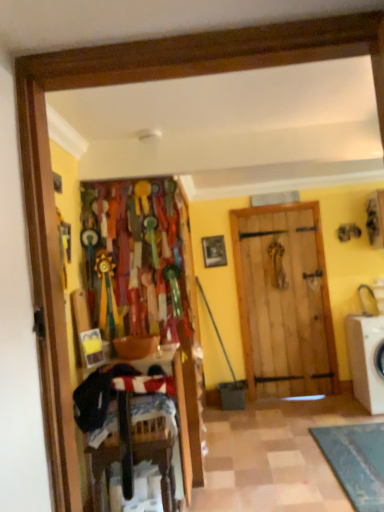
Question: Can you confirm if dark blue fabric laundry at lower left is positioned to the right of white plastic washing machine at right?

Choices:
 (A) yes
 (B) no

Answer: (B)

Question: From a real-world perspective, is dark blue fabric laundry at lower left under white plastic washing machine at right?

Choices:
 (A) yes
 (B) no

Answer: (B)

Question: Does dark blue fabric laundry at lower left have a larger size compared to white plastic washing machine at right?

Choices:
 (A) yes
 (B) no

Answer: (B)

Question: From the image's perspective, would you say dark blue fabric laundry at lower left is positioned over white plastic washing machine at right?

Choices:
 (A) no
 (B) yes

Answer: (B)

Question: Is dark blue fabric laundry at lower left not near white plastic washing machine at right?

Choices:
 (A) no
 (B) yes

Answer: (B)

Question: Do you think white plastic washing machine at right is within dark blue fabric laundry at lower left, or outside of it?

Choices:
 (A) inside
 (B) outside

Answer: (B)

Question: Considering the positions of point (350, 346) and point (81, 430), is point (350, 346) closer or farther from the camera than point (81, 430)?

Choices:
 (A) closer
 (B) farther

Answer: (B)

Question: From the image's perspective, is white plastic washing machine at right above or below dark blue fabric laundry at lower left?

Choices:
 (A) above
 (B) below

Answer: (B)

Question: From a real-world perspective, is white plastic washing machine at right positioned above or below dark blue fabric laundry at lower left?

Choices:
 (A) above
 (B) below

Answer: (B)

Question: From the image's perspective, is dark blue fabric laundry at lower left located above or below white plastic washing machine at right?

Choices:
 (A) below
 (B) above

Answer: (B)

Question: Based on their positions, is dark blue fabric laundry at lower left located to the left or right of white plastic washing machine at right?

Choices:
 (A) left
 (B) right

Answer: (A)

Question: From a real-world perspective, is dark blue fabric laundry at lower left physically located above or below white plastic washing machine at right?

Choices:
 (A) above
 (B) below

Answer: (A)

Question: Relative to white plastic washing machine at right, is dark blue fabric laundry at lower left in front or behind?

Choices:
 (A) front
 (B) behind

Answer: (A)

Question: Is wooden picture frame at center bigger or smaller than white plastic washing machine at right?

Choices:
 (A) small
 (B) big

Answer: (A)

Question: In the image, is wooden picture frame at center positioned in front of or behind white plastic washing machine at right?

Choices:
 (A) front
 (B) behind

Answer: (B)